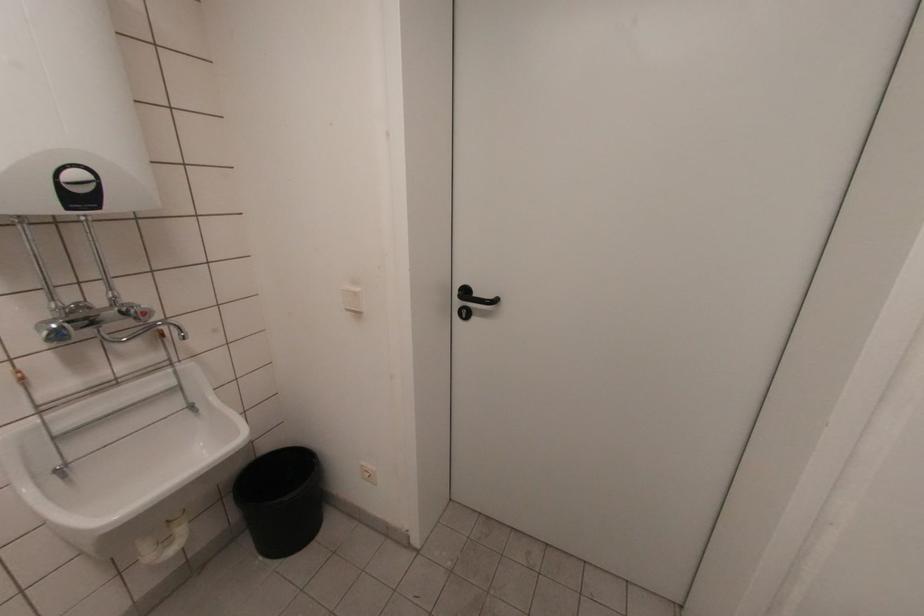
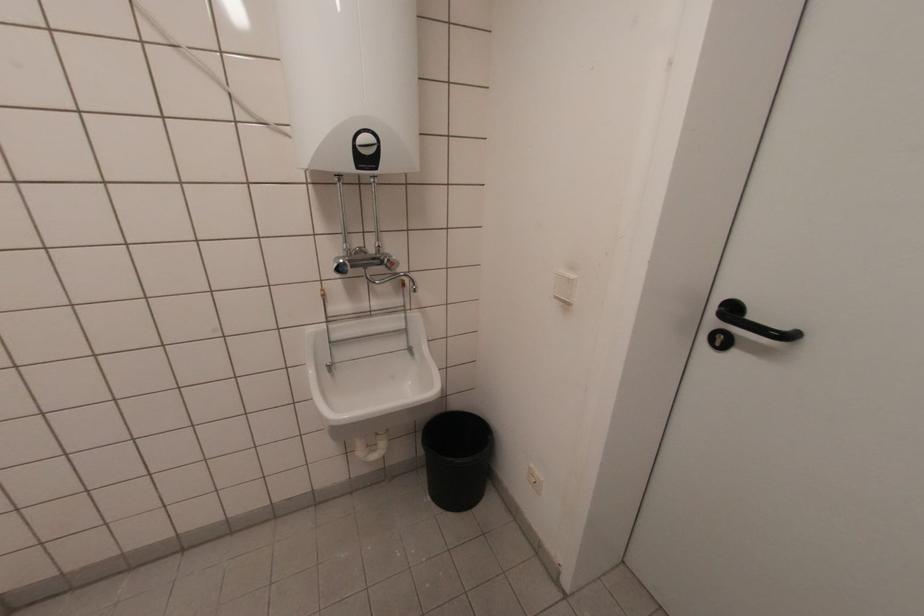
The point at (94, 185) is marked in the first image. Where is the corresponding point in the second image?

(377, 148)